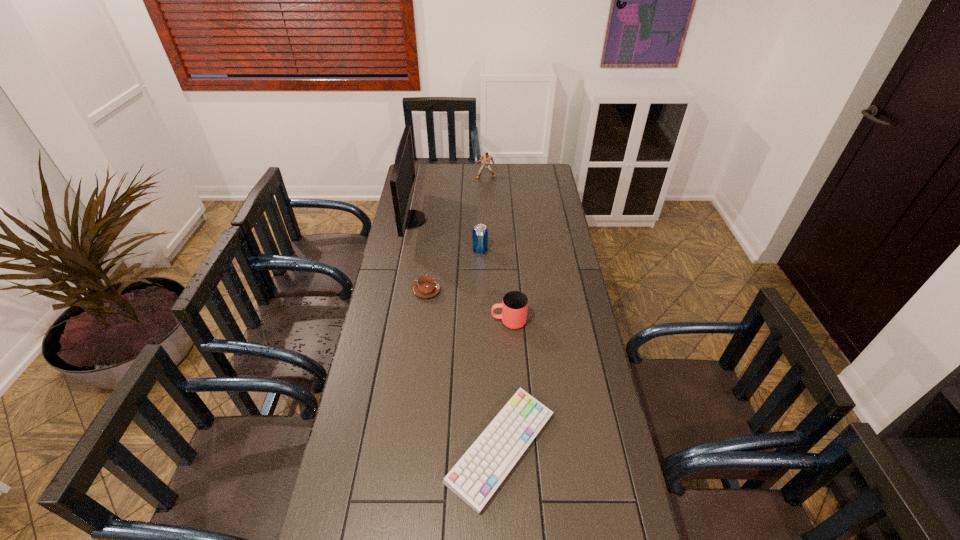
Identify the location of free spot that satisfies the following two spatial constraints: 1. on the back side of the nearest object; 2. on the front-facing side of the tallest object. (492, 220).

Identify the location of vacant space that satisfies the following two spatial constraints: 1. on the handle side of the cup; 2. on the side of the cappuccino with the handle. The height and width of the screenshot is (540, 960). (507, 291).

In order to click on free space that satisfies the following two spatial constraints: 1. on the front-facing side of the tallest object; 2. on the left side of the beer can in this screenshot , I will do `click(405, 251)`.